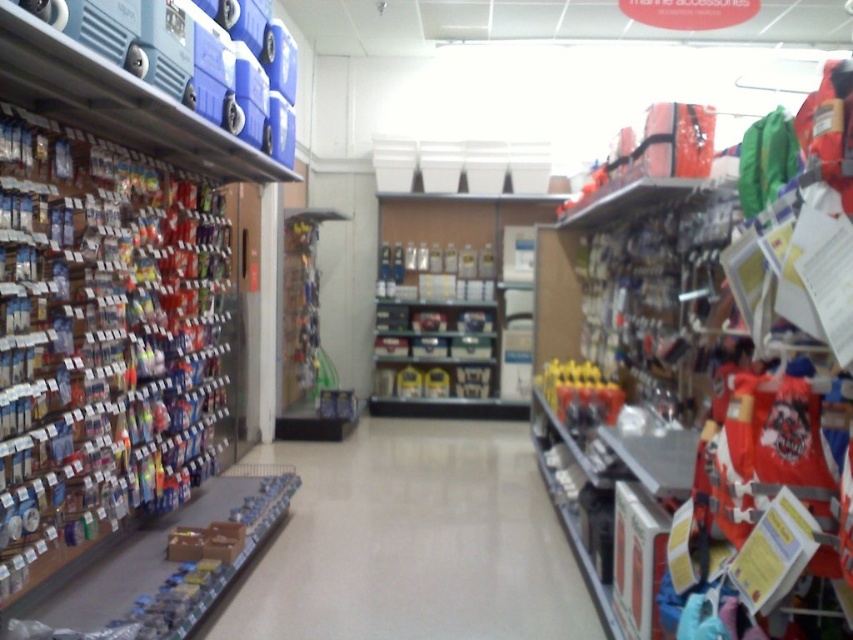
Looking at this image, you are a customer in the store and want to place a large box on the floor. Considering the white glossy floor at center and metallic silver canisters at center, which surface can you use for placing the box?

You can place the large box on the white glossy floor at center because it is lower than the metallic silver canisters at center, making it suitable for placing items on the ground.

You are navigating an aisle in the store and want to move from the wall display to the back of the store. There are two points marked as point 1 at coordinates [390,524] and point 2 at coordinates [584,365]. Which point should you pass through first to reach the back of the store?

You should pass through point 1 at coordinates [390,524] first because it is in front of point 2 at coordinates [584,365] along the path to the back of the store.